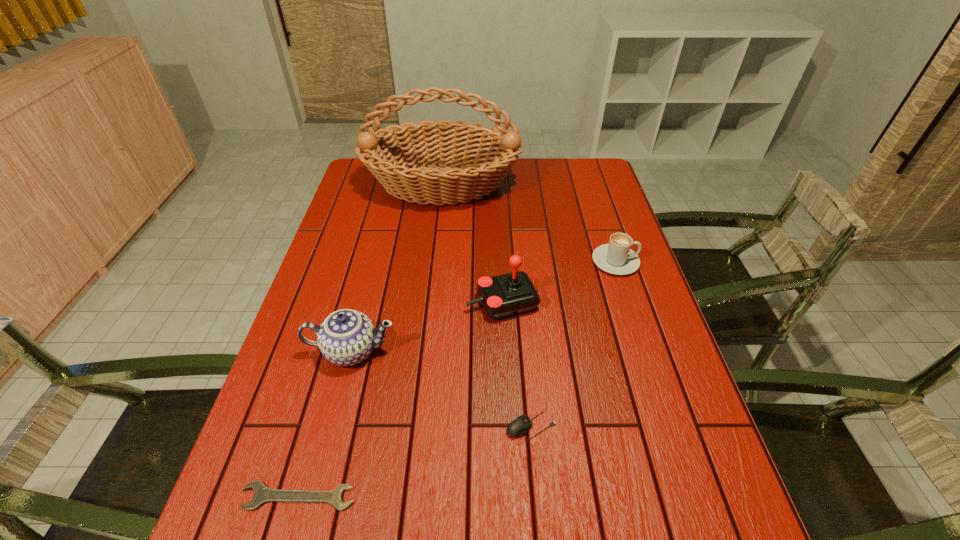
You are a GUI agent. You are given a task and a screenshot of the screen. Output one action in this format:
    pyautogui.click(x=<x>, y=<y>)
    Task: Click on the basket
    This screenshot has width=960, height=540.
    Given the screenshot: What is the action you would take?
    pyautogui.click(x=400, y=167)

Where is `the tallest object`? This screenshot has width=960, height=540. the tallest object is located at coordinates pyautogui.click(x=400, y=167).

Find the location of a particular element. The width and height of the screenshot is (960, 540). joystick is located at coordinates (505, 295).

Locate an element on the screen. The width and height of the screenshot is (960, 540). the fifth shortest object is located at coordinates (505, 295).

Locate an element on the screen. Image resolution: width=960 pixels, height=540 pixels. the fourth farthest object is located at coordinates (346, 337).

Where is `chinaware`? chinaware is located at coordinates (346, 337).

This screenshot has width=960, height=540. What are the coordinates of `the rightmost object` in the screenshot? It's located at (617, 258).

Find the location of a particular element. Image resolution: width=960 pixels, height=540 pixels. the third shortest object is located at coordinates (617, 258).

Where is `the fifth tallest object`? This screenshot has height=540, width=960. the fifth tallest object is located at coordinates (519, 427).

Where is `the fifth farthest object`? The height and width of the screenshot is (540, 960). the fifth farthest object is located at coordinates (519, 427).